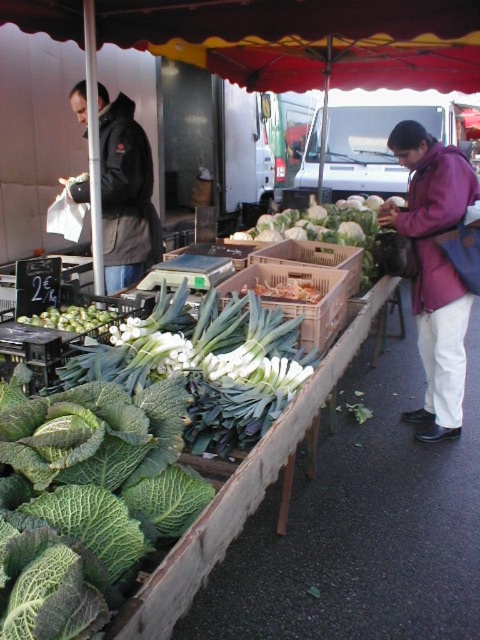
Can you confirm if wooden crate at center is bigger than green leafy vegetable at center?

Incorrect, wooden crate at center is not larger than green leafy vegetable at center.

Does wooden crate at center appear under green leafy vegetable at center?

Yes.

Where is `wooden crate at center`? The image size is (480, 640). wooden crate at center is located at coordinates (299, 296).

Looking at this image, is dark gray jacket at left positioned at the back of green leafy at center?

Yes, dark gray jacket at left is behind green leafy at center.

Between point (74, 92) and point (43, 316), which one is positioned behind?

The point (74, 92) is behind.

Where is `dark gray jacket at left`? Image resolution: width=480 pixels, height=640 pixels. dark gray jacket at left is located at coordinates (126, 195).

Does purple fleece jacket at right have a smaller size compared to wooden crate at center?

Actually, purple fleece jacket at right might be larger than wooden crate at center.

Can you confirm if purple fleece jacket at right is taller than wooden crate at center?

Correct, purple fleece jacket at right is much taller as wooden crate at center.

What do you see at coordinates (437, 268) in the screenshot? I see `purple fleece jacket at right` at bounding box center [437, 268].

Locate an element on the screen. purple fleece jacket at right is located at coordinates (437, 268).